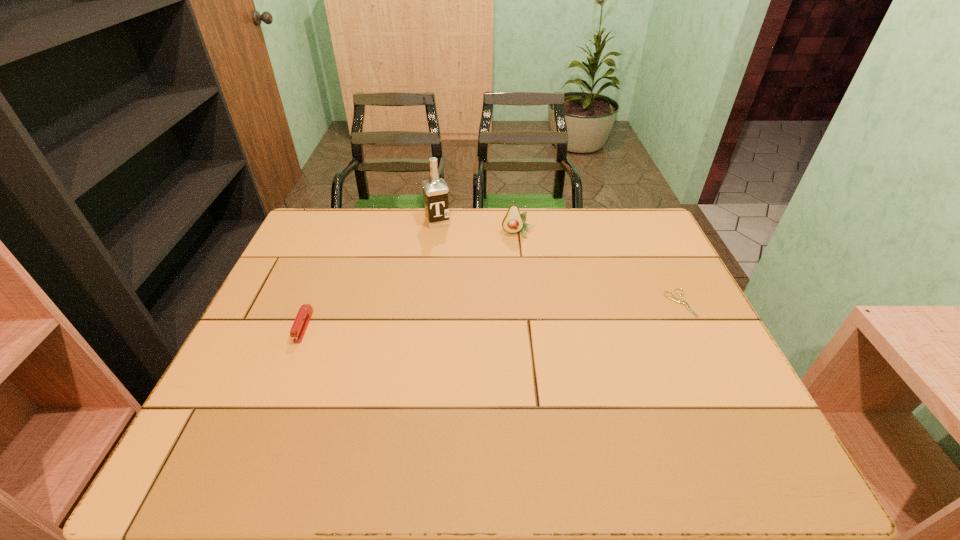
The image size is (960, 540). What are the coordinates of `free spot on the desktop that is between the stapler and the shears and is positioned on the front label of the second object from left to right` in the screenshot? It's located at (481, 315).

Where is `vacant space on the desktop that is between the third tallest object and the rightmost object and is positioned on the seed side of the third object from left to right`? vacant space on the desktop that is between the third tallest object and the rightmost object and is positioned on the seed side of the third object from left to right is located at coordinates tap(530, 313).